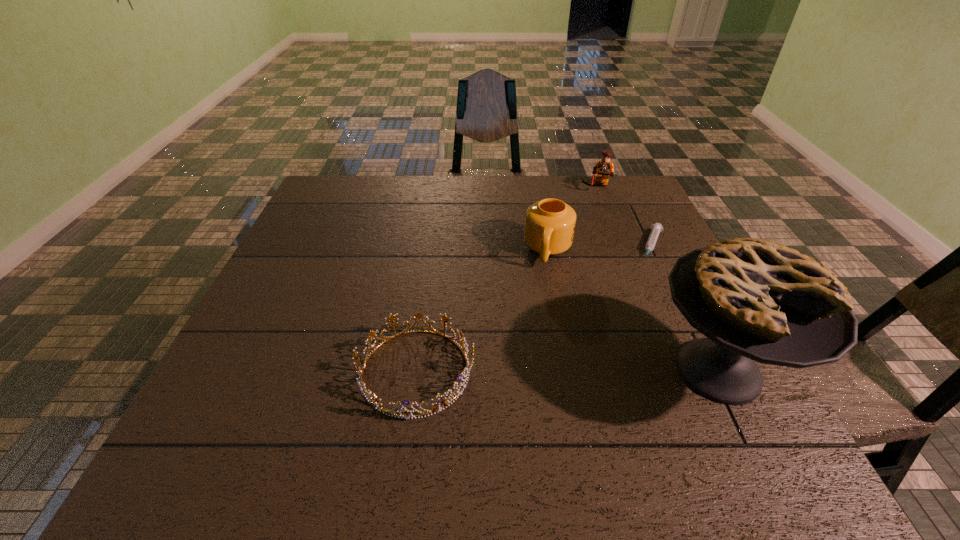
Where is `vacant space located 0.330m holding a crossbow in the hands of the farthest object`? Image resolution: width=960 pixels, height=540 pixels. vacant space located 0.330m holding a crossbow in the hands of the farthest object is located at coordinates (582, 255).

The height and width of the screenshot is (540, 960). I want to click on vacant space located 0.260m holding a crossbow in the hands of the farthest object, so click(x=586, y=240).

Where is `vacant area located 0.140m holding a crossbow in the hands of the farthest object`? This screenshot has height=540, width=960. vacant area located 0.140m holding a crossbow in the hands of the farthest object is located at coordinates (590, 218).

Locate an element on the screen. This screenshot has height=540, width=960. vacant space located 0.090m on the handle side of the second object from left to right is located at coordinates (541, 294).

The image size is (960, 540). I want to click on vacant region located on the handle side of the second object from left to right, so click(x=539, y=306).

You are a GUI agent. You are given a task and a screenshot of the screen. Output one action in this format:
    pyautogui.click(x=<x>, y=<y>)
    Task: Click on the free space located on the handle side of the second object from left to right
    The image size is (960, 540).
    Given the screenshot: What is the action you would take?
    coord(529,352)

You are a GUI agent. You are given a task and a screenshot of the screen. Output one action in this format:
    pyautogui.click(x=<x>, y=<y>)
    Task: Click on the object located in the far edge section of the desktop
    This screenshot has width=960, height=540.
    Given the screenshot: What is the action you would take?
    pyautogui.click(x=604, y=168)

Where is `tiara located at the near edge`? tiara located at the near edge is located at coordinates coord(374,400).

I want to click on pie present at the near edge, so click(x=755, y=300).

Locate an element on the screen. The width and height of the screenshot is (960, 540). pie positioned at the right edge is located at coordinates (755, 300).